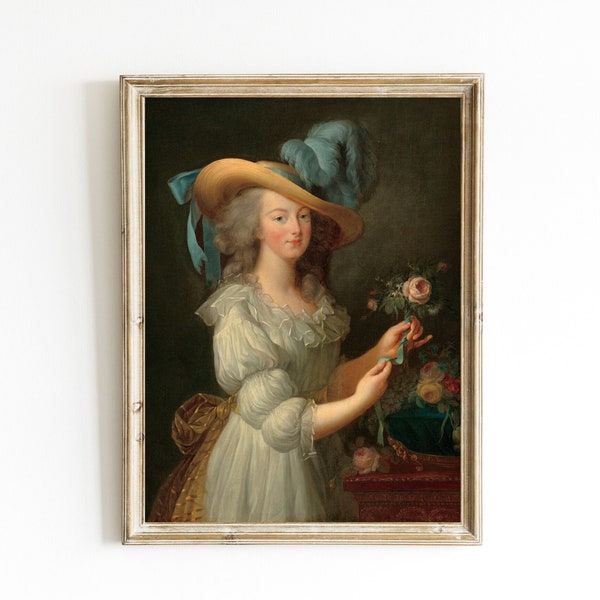
Locate an element on the screen. This screenshot has height=600, width=600. white background wall is located at coordinates (46, 452), (280, 570), (503, 357).